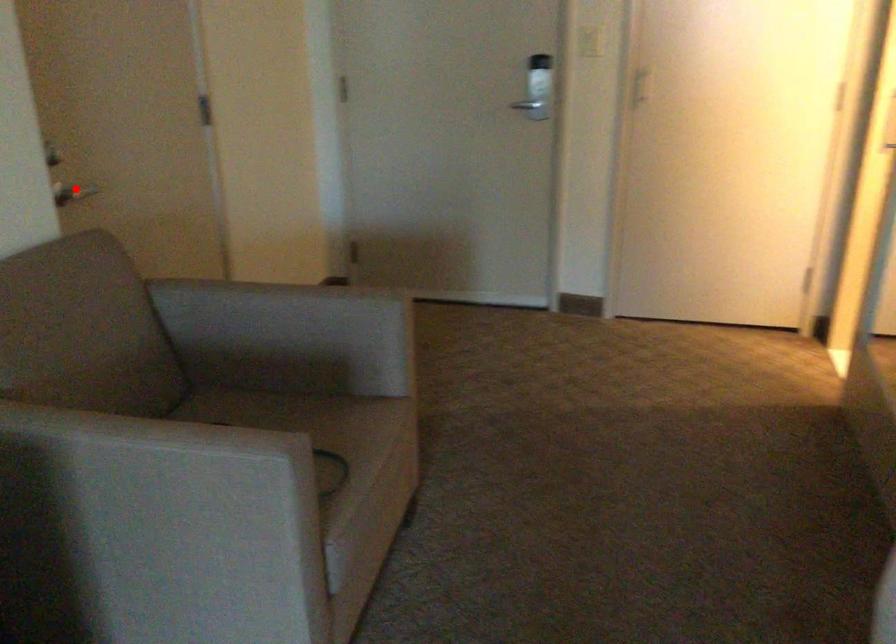
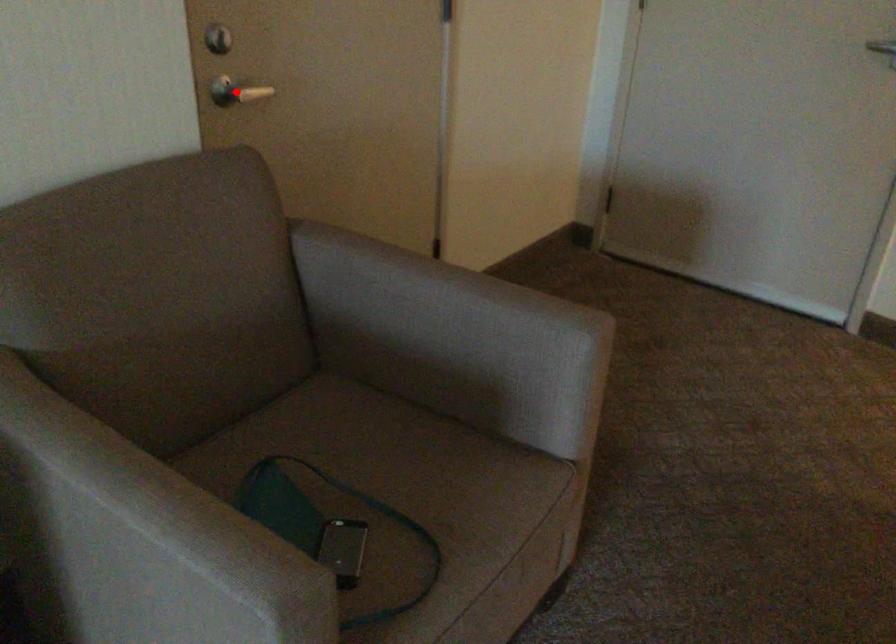
I am providing you with two images of the same scene from different viewpoints. A red point is marked on the first image and another point is marked on the second image. Are the points marked in image1 and image2 representing the same 3D position?

Yes